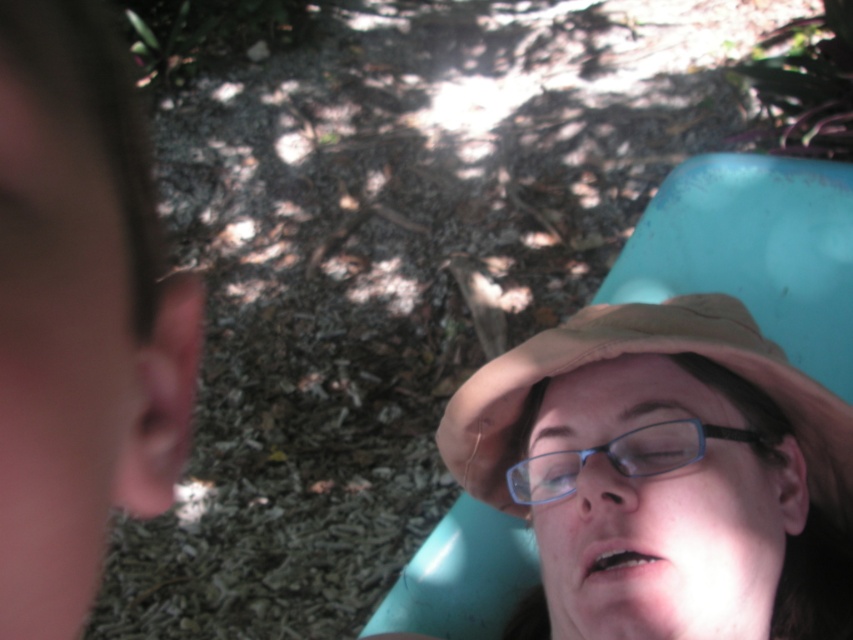
You are a photographer trying to capture a closeup of the tan fabric hat at upper center. However, the blurred skin ear at left is blocking part of the hat. Can you move 40 centimeters to the left to avoid the ear?

The distance between the blurred skin ear at left and tan fabric hat at upper center is 43.50 centimeters. Moving 40 centimeters to the left would still leave 3.5 centimeters between them, so the ear might still partially block the hat. Move a bit further to ensure full visibility.

You are a photographer trying to capture a closeup of the blue plastic glasses at center and the blurred skin ear at left. Which object would appear more detailed in your photo?

The blue plastic glasses at center would appear more detailed in the photo because they are thicker than the blurred skin ear at left.

You are standing at the center of the image and want to locate the tan fabric hat at upper center. In which direction should you look to find it?

The tan fabric hat at upper center is located at the upper center of the image, so you should look upwards from the center to find it.